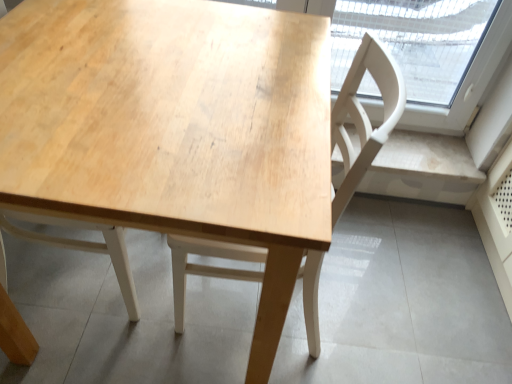
Where is `free space above natural wood table at center (from a real-world perspective)`? The height and width of the screenshot is (384, 512). free space above natural wood table at center (from a real-world perspective) is located at coordinates (142, 110).